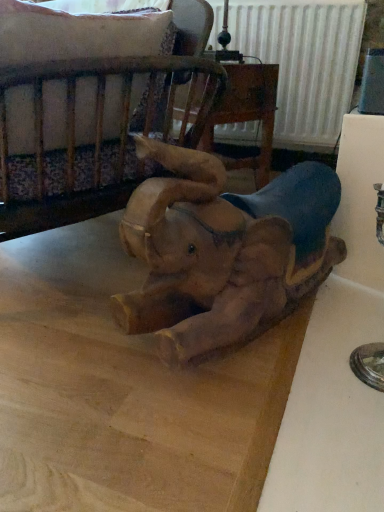
Question: Should I look upward or downward to see wooden crib at upper left?

Choices:
 (A) up
 (B) down

Answer: (A)

Question: From a real-world perspective, is wooden crib at upper left beneath wooden elephant at center?

Choices:
 (A) yes
 (B) no

Answer: (B)

Question: Is wooden crib at upper left taller than wooden elephant at center?

Choices:
 (A) yes
 (B) no

Answer: (B)

Question: Can you confirm if wooden crib at upper left is positioned to the right of wooden elephant at center?

Choices:
 (A) no
 (B) yes

Answer: (A)

Question: Is the depth of wooden crib at upper left greater than that of wooden elephant at center?

Choices:
 (A) no
 (B) yes

Answer: (B)

Question: Is wooden crib at upper left outside of wooden elephant at center?

Choices:
 (A) no
 (B) yes

Answer: (B)

Question: Is the position of wooden crib at upper left less distant than that of wooden elephant at center?

Choices:
 (A) no
 (B) yes

Answer: (A)

Question: Could wooden crib at upper left be considered to be inside wooden elephant at center?

Choices:
 (A) no
 (B) yes

Answer: (A)

Question: Could you tell me if wooden elephant at center is turned towards wooden crib at upper left?

Choices:
 (A) yes
 (B) no

Answer: (A)

Question: Is wooden elephant at center with wooden crib at upper left?

Choices:
 (A) yes
 (B) no

Answer: (B)

Question: Are wooden elephant at center and wooden crib at upper left located far from each other?

Choices:
 (A) yes
 (B) no

Answer: (B)

Question: Is wooden elephant at center smaller than wooden crib at upper left?

Choices:
 (A) no
 (B) yes

Answer: (A)

Question: Is wooden elephant at center positioned with its back to wooden crib at upper left?

Choices:
 (A) no
 (B) yes

Answer: (A)

Question: Is wooden crib at upper left in front of or behind wooden elephant at center in the image?

Choices:
 (A) behind
 (B) front

Answer: (A)